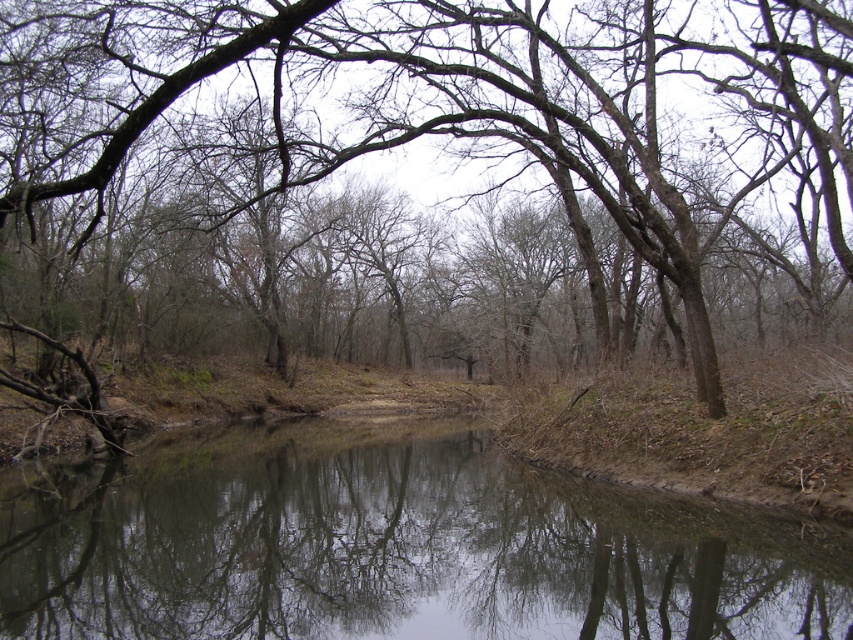
Question: Does brown rough tree at center appear on the right side of clear water at center?

Choices:
 (A) no
 (B) yes

Answer: (B)

Question: Can you confirm if brown rough tree at center is positioned to the left of clear water at center?

Choices:
 (A) no
 (B) yes

Answer: (A)

Question: Is brown rough tree at center thinner than clear water at center?

Choices:
 (A) no
 (B) yes

Answer: (A)

Question: Which of the following is the closest to the observer?

Choices:
 (A) (840, 556)
 (B) (135, 60)

Answer: (A)